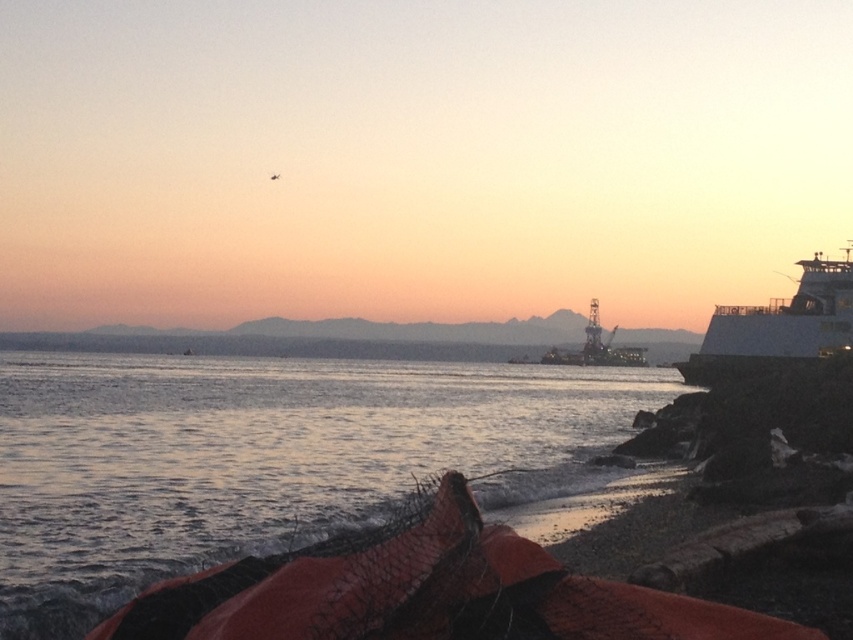
Is glistening water at lower left closer to camera compared to white matte ferry at right?

Yes, it is.

Who is more distant from viewer, [373,460] or [770,316]?

The point [770,316] is behind.

Locate an element on the screen. glistening water at lower left is located at coordinates (271, 460).

Between white matte ferry at right and metallic gray oil rig at center, which one appears on the right side from the viewer's perspective?

From the viewer's perspective, white matte ferry at right appears more on the right side.

Between white matte ferry at right and metallic gray oil rig at center, which one appears on the left side from the viewer's perspective?

metallic gray oil rig at center is more to the left.

Locate an element on the screen. white matte ferry at right is located at coordinates (778, 326).

Locate an element on the screen. The image size is (853, 640). white matte ferry at right is located at coordinates [x=778, y=326].

Can you confirm if glistening water at lower left is positioned to the right of metallic gray oil rig at center?

No, glistening water at lower left is not to the right of metallic gray oil rig at center.

Is point (225, 392) positioned before point (637, 349)?

Yes, it is in front of point (637, 349).

Between point (277, 518) and point (570, 364), which one is positioned in front?

Point (277, 518) is more forward.

Locate an element on the screen. Image resolution: width=853 pixels, height=640 pixels. glistening water at lower left is located at coordinates (271, 460).